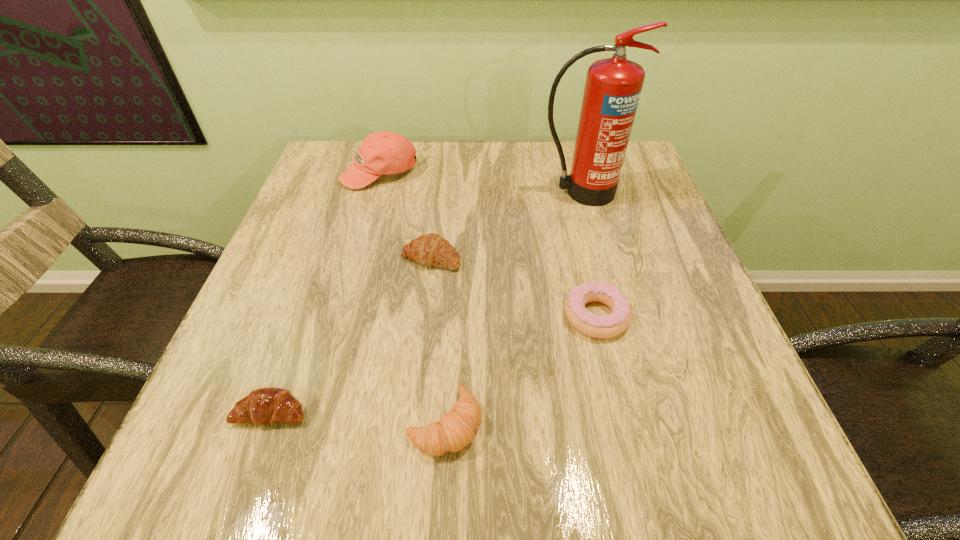
Find the location of a particular element. free space located on the back of the shortest crescent roll is located at coordinates (298, 338).

Image resolution: width=960 pixels, height=540 pixels. In order to click on fire extinguisher at the far edge in this screenshot , I will do `click(613, 86)`.

The width and height of the screenshot is (960, 540). I want to click on baseball cap that is positioned at the far edge, so click(385, 152).

You are a GUI agent. You are given a task and a screenshot of the screen. Output one action in this format:
    pyautogui.click(x=<x>, y=<y>)
    Task: Click on the object that is at the near edge
    
    Given the screenshot: What is the action you would take?
    pyautogui.click(x=456, y=429)

Identify the location of baseball cap at the left edge. (385, 152).

Locate an element on the screen. crescent roll that is at the left edge is located at coordinates (265, 406).

You are a GUI agent. You are given a task and a screenshot of the screen. Output one action in this format:
    pyautogui.click(x=<x>, y=<y>)
    Task: Click on the fire extinguisher present at the right edge
    The image size is (960, 540).
    Given the screenshot: What is the action you would take?
    pyautogui.click(x=613, y=86)

Identify the location of doughnut that is at the right edge. This screenshot has height=540, width=960. (599, 326).

Where is `object present at the far left corner`? object present at the far left corner is located at coordinates (385, 152).

Identify the location of object situated at the far right corner. The image size is (960, 540). (613, 86).